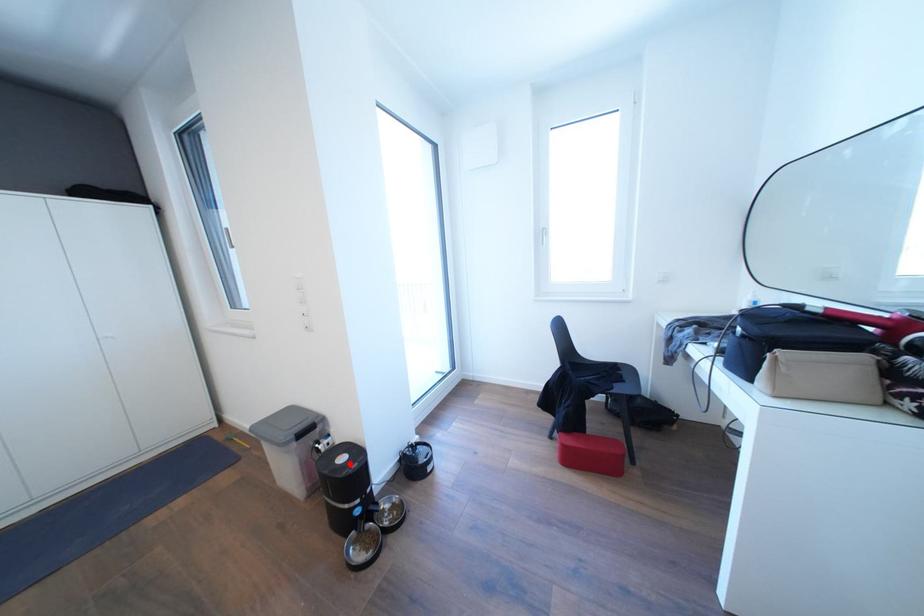
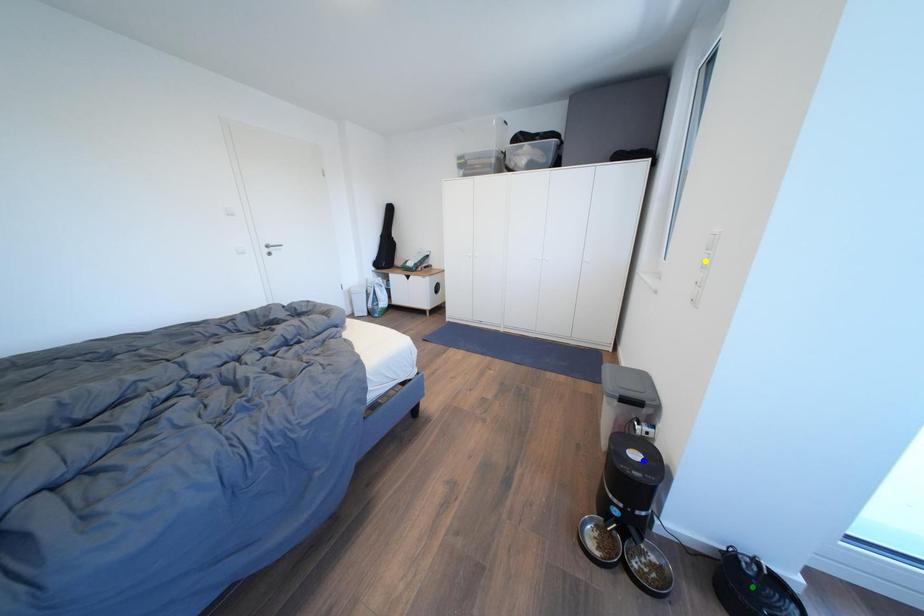
Question: I am providing you with two images of the same scene from different viewpoints. A red point is marked on the first image. You are given multiple points on the second image. Which mark in image 2 goes with the point in image 1?

Choices:
 (A) blue point
 (B) green point
 (C) yellow point

Answer: (A)